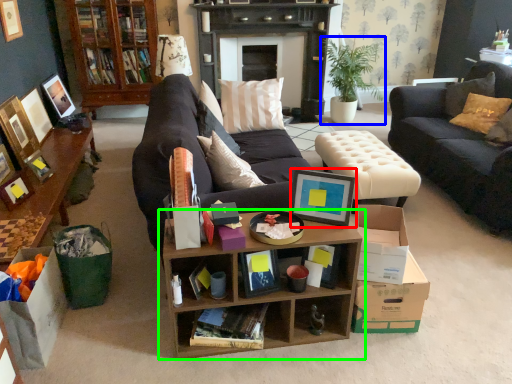
Question: Which object is positioned farthest from picture frame (highlighted by a red box)? Select from houseplant (highlighted by a blue box) and shelf (highlighted by a green box).

Choices:
 (A) houseplant
 (B) shelf

Answer: (A)